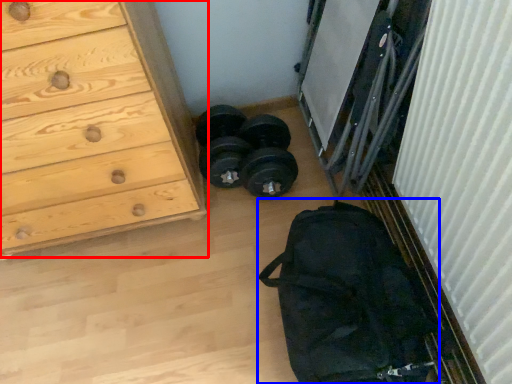
Question: Which object appears farthest to the camera in this image, chest of drawers (highlighted by a red box) or bag (highlighted by a blue box)?

Choices:
 (A) chest of drawers
 (B) bag

Answer: (B)